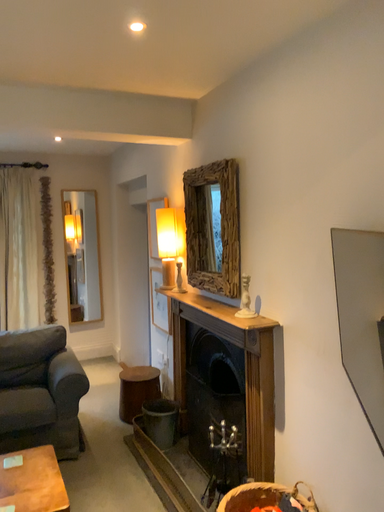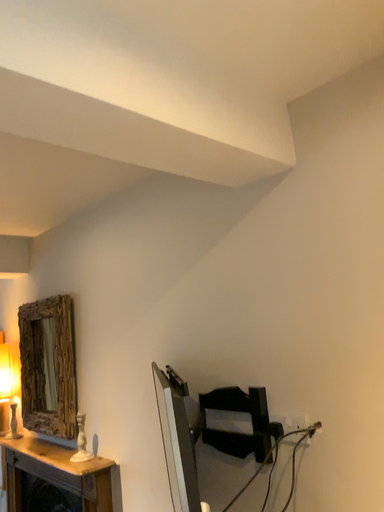
Question: How did the camera likely rotate when shooting the video?

Choices:
 (A) rotated downward
 (B) rotated upward

Answer: (B)